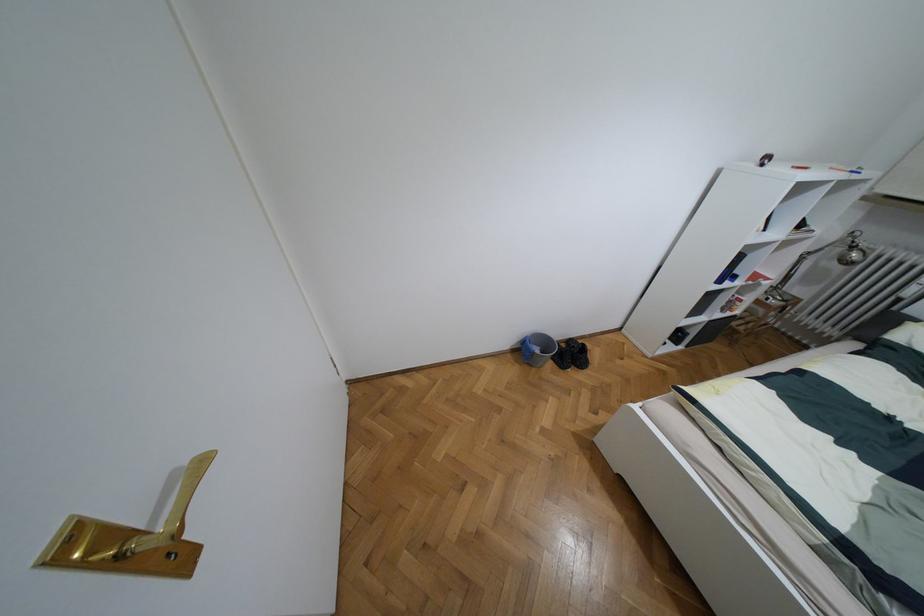
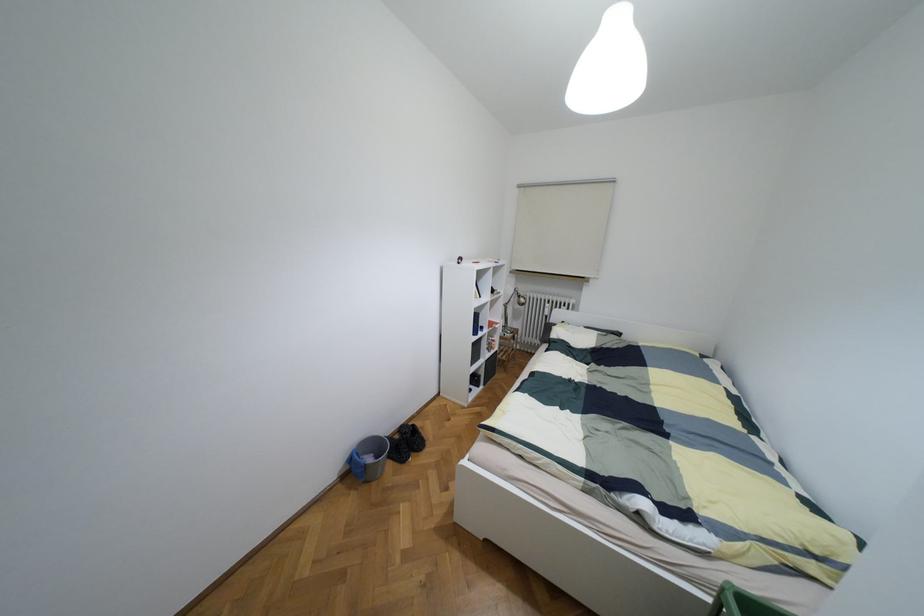
Where in the second image is the point corresponding to point (536, 350) from the first image?

(369, 459)